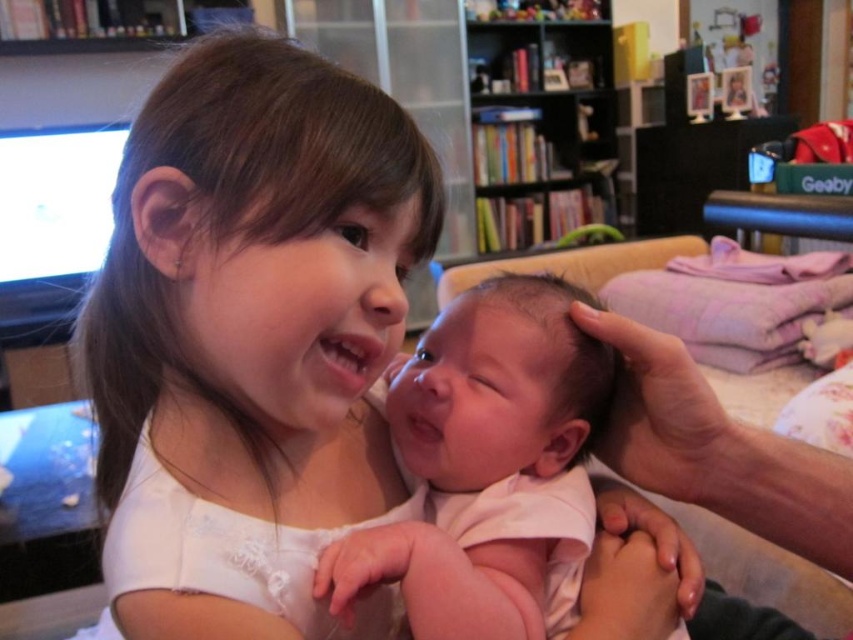
Question: Which of the following is the farthest from the observer?

Choices:
 (A) (590, 424)
 (B) (525, 109)

Answer: (B)

Question: Which point is farther to the camera?

Choices:
 (A) wooden bookshelf at upper center
 (B) smooth white shirt at center

Answer: (A)

Question: Does smooth white shirt at center appear over pink soft fabric baby at center?

Choices:
 (A) no
 (B) yes

Answer: (B)

Question: Which object is the closest to the smooth white shirt at center?

Choices:
 (A) wooden bookshelf at upper center
 (B) pink soft fabric baby at center

Answer: (B)

Question: Is pink soft fabric baby at center positioned at the back of wooden bookshelf at upper center?

Choices:
 (A) no
 (B) yes

Answer: (A)

Question: Is pink soft fabric baby at center wider than wooden bookshelf at upper center?

Choices:
 (A) yes
 (B) no

Answer: (B)